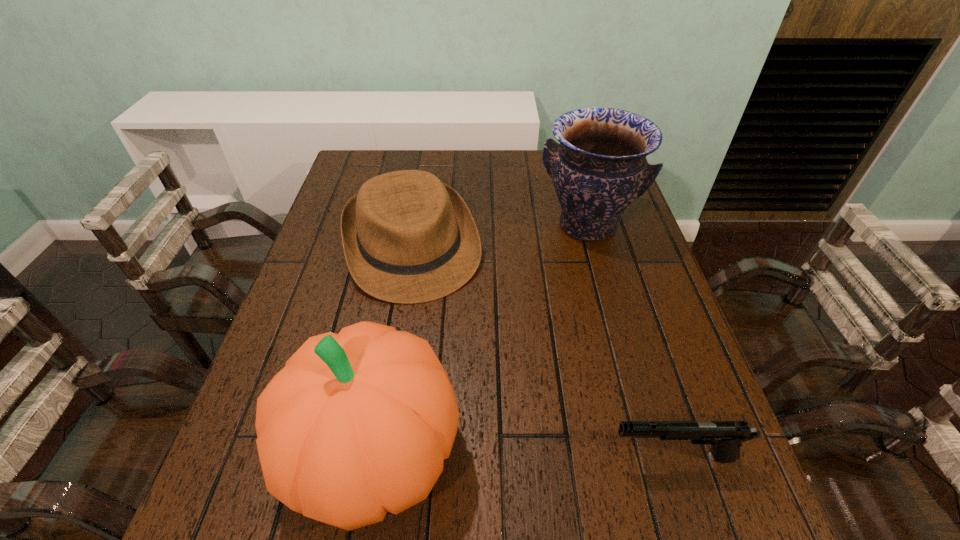
Find the location of a particular element. vacant space that satisfies the following two spatial constraints: 1. on the front side of the pottery; 2. at the aiming end of the shortest object is located at coordinates (651, 456).

Find the location of a particular element. The width and height of the screenshot is (960, 540). free location that satisfies the following two spatial constraints: 1. on the front side of the pottery; 2. at the aiming end of the gun is located at coordinates (651, 456).